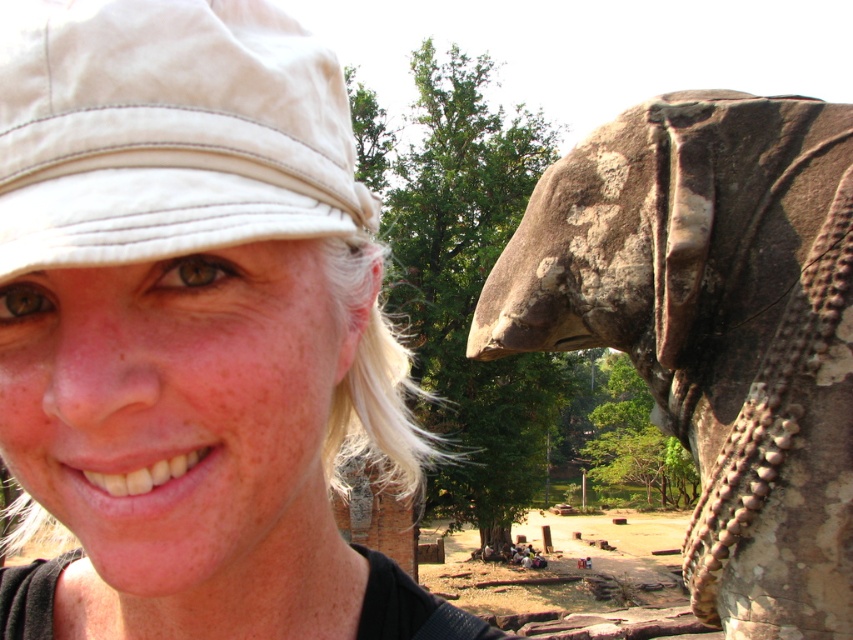
Question: In this image, where is white matte hat at upper left located relative to rusty stone elephant at right?

Choices:
 (A) left
 (B) right

Answer: (A)

Question: Does white matte hat at upper left come in front of rusty stone elephant at right?

Choices:
 (A) no
 (B) yes

Answer: (B)

Question: Which point appears farthest from the camera in this image?

Choices:
 (A) (77, 100)
 (B) (287, 588)

Answer: (B)

Question: Which of the following is the farthest from the observer?

Choices:
 (A) (543, 324)
 (B) (183, 90)

Answer: (A)

Question: Can you confirm if rusty stone elephant at right is positioned to the left of white cotton cap at upper left?

Choices:
 (A) no
 (B) yes

Answer: (A)

Question: Which of the following is the farthest from the observer?

Choices:
 (A) (131, 8)
 (B) (698, 369)

Answer: (B)